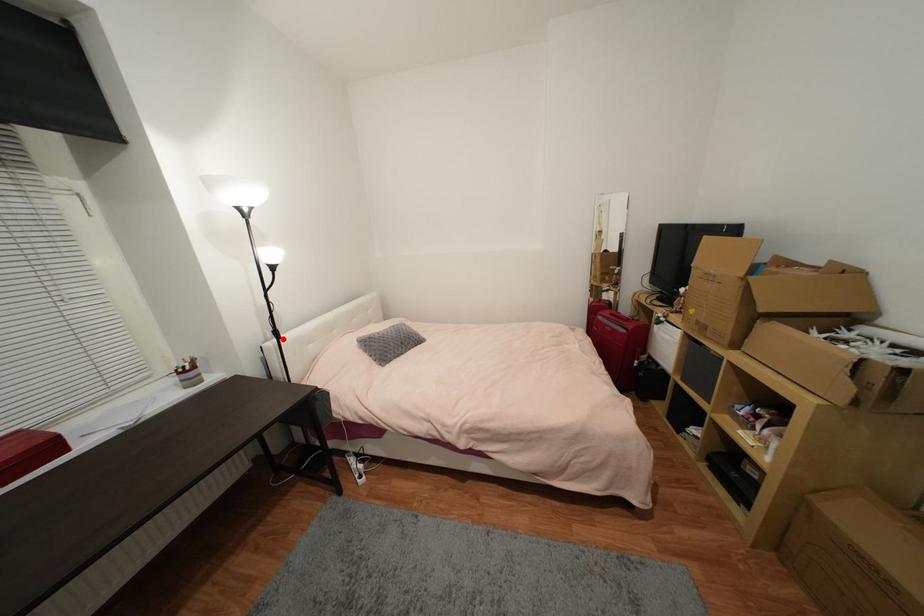
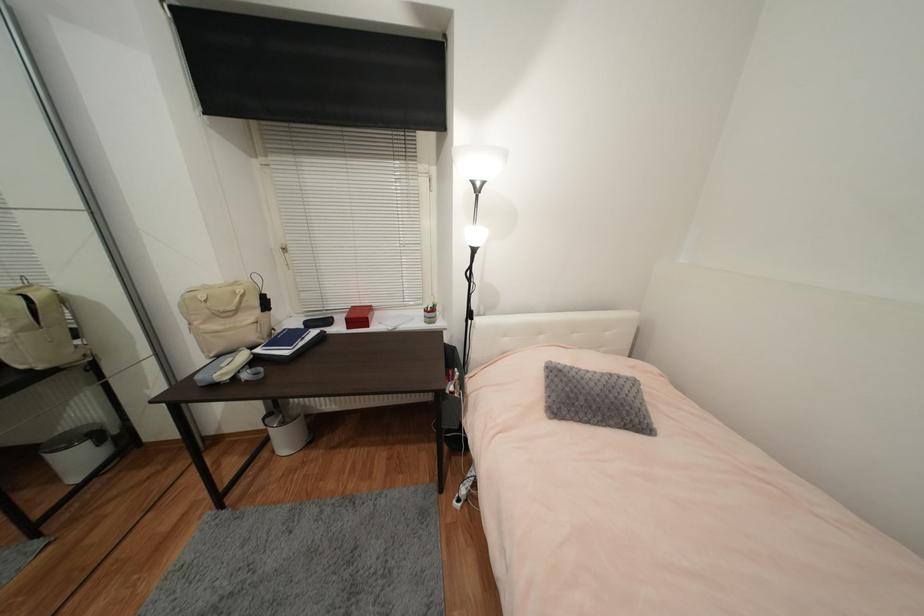
Where in the second image is the point corresponding to the highlighted location from the first image?

(473, 320)